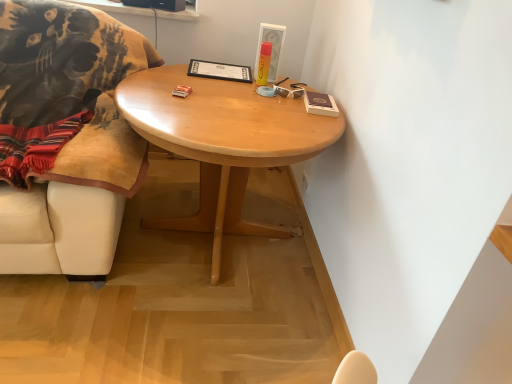
Question: Can you confirm if light wood/finish coffee table at center is bigger than white plastic sunglasses at upper right?

Choices:
 (A) no
 (B) yes

Answer: (B)

Question: Can you see light wood/finish coffee table at center touching white plastic sunglasses at upper right?

Choices:
 (A) no
 (B) yes

Answer: (A)

Question: From the image's perspective, does light wood/finish coffee table at center appear lower than white plastic sunglasses at upper right?

Choices:
 (A) no
 (B) yes

Answer: (B)

Question: From a real-world perspective, does light wood/finish coffee table at center stand above white plastic sunglasses at upper right?

Choices:
 (A) yes
 (B) no

Answer: (B)

Question: Is white plastic sunglasses at upper right located within light wood/finish coffee table at center?

Choices:
 (A) no
 (B) yes

Answer: (B)

Question: From a real-world perspective, is white plastic sunglasses at upper right positioned above or below matte white picture frame at upper center?

Choices:
 (A) above
 (B) below

Answer: (B)

Question: In terms of height, does white plastic sunglasses at upper right look taller or shorter compared to matte white picture frame at upper center?

Choices:
 (A) tall
 (B) short

Answer: (B)

Question: Does point (303, 84) appear closer or farther from the camera than point (258, 46)?

Choices:
 (A) closer
 (B) farther

Answer: (A)

Question: From the image's perspective, relative to matte white picture frame at upper center, is white plastic sunglasses at upper right above or below?

Choices:
 (A) below
 (B) above

Answer: (A)

Question: From the image's perspective, is light wood/finish coffee table at center positioned above or below white plastic sunglasses at upper right?

Choices:
 (A) below
 (B) above

Answer: (A)

Question: Relative to white plastic sunglasses at upper right, is light wood/finish coffee table at center in front or behind?

Choices:
 (A) front
 (B) behind

Answer: (A)

Question: Does point (326, 135) appear closer or farther from the camera than point (287, 97)?

Choices:
 (A) farther
 (B) closer

Answer: (B)

Question: Considering the positions of light wood/finish coffee table at center and white plastic sunglasses at upper right in the image, is light wood/finish coffee table at center wider or thinner than white plastic sunglasses at upper right?

Choices:
 (A) wide
 (B) thin

Answer: (A)

Question: From the image's perspective, is matte white picture frame at upper center located above or below light wood/finish coffee table at center?

Choices:
 (A) below
 (B) above

Answer: (B)

Question: Relative to light wood/finish coffee table at center, is matte white picture frame at upper center in front or behind?

Choices:
 (A) behind
 (B) front

Answer: (A)